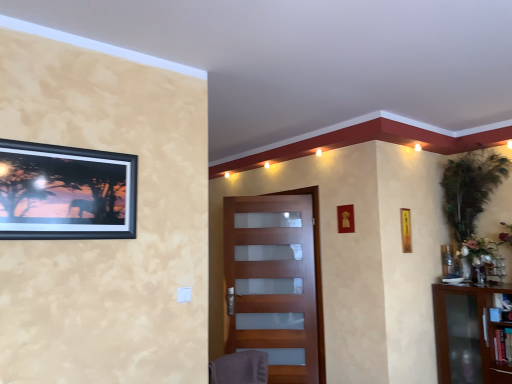
Question: Can green leafy plant at upper right be found inside transparent glass cabinet at right?

Choices:
 (A) yes
 (B) no

Answer: (B)

Question: Is the position of transparent glass cabinet at right more distant than that of green leafy plant at upper right?

Choices:
 (A) yes
 (B) no

Answer: (B)

Question: Would you say transparent glass cabinet at right is outside green leafy plant at upper right?

Choices:
 (A) no
 (B) yes

Answer: (B)

Question: Is green leafy plant at upper right at the back of transparent glass cabinet at right?

Choices:
 (A) no
 (B) yes

Answer: (A)

Question: Does transparent glass cabinet at right appear on the right side of green leafy plant at upper right?

Choices:
 (A) yes
 (B) no

Answer: (A)

Question: Is transparent glass cabinet at right positioned far away from green leafy plant at upper right?

Choices:
 (A) no
 (B) yes

Answer: (A)

Question: Does green leafy plant at upper right come behind transparent glass cabinet at right?

Choices:
 (A) no
 (B) yes

Answer: (B)

Question: Does green leafy plant at upper right have a greater height compared to transparent glass cabinet at right?

Choices:
 (A) no
 (B) yes

Answer: (B)

Question: Does green leafy plant at upper right appear on the left side of transparent glass cabinet at right?

Choices:
 (A) yes
 (B) no

Answer: (A)

Question: Could you tell me if green leafy plant at upper right is facing transparent glass cabinet at right?

Choices:
 (A) no
 (B) yes

Answer: (A)

Question: From a real-world perspective, is green leafy plant at upper right below transparent glass cabinet at right?

Choices:
 (A) yes
 (B) no

Answer: (B)

Question: Considering the relative sizes of green leafy plant at upper right and transparent glass cabinet at right in the image provided, is green leafy plant at upper right shorter than transparent glass cabinet at right?

Choices:
 (A) no
 (B) yes

Answer: (A)

Question: Is yellow paper at upper right, the first picture frame in the bottom-to-top sequence, far away from transparent glass cabinet at right?

Choices:
 (A) yes
 (B) no

Answer: (B)